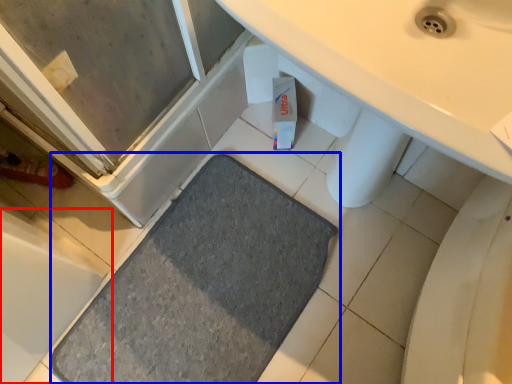
Question: Which of the following is the farthest to the observer, bath (highlighted by a red box) or bath mat (highlighted by a blue box)?

Choices:
 (A) bath
 (B) bath mat

Answer: (B)